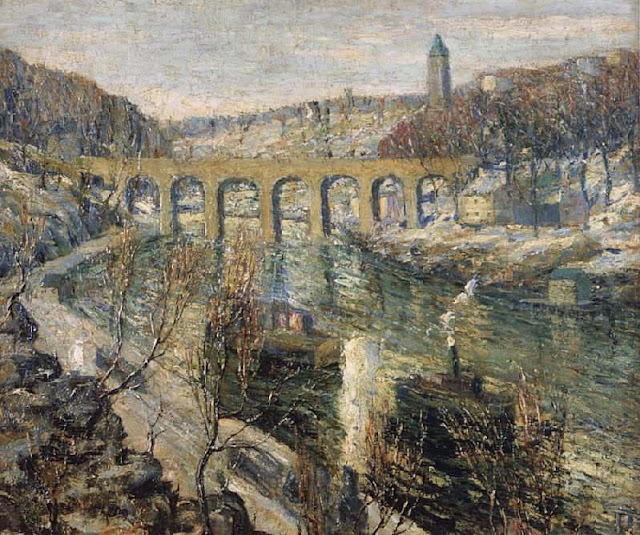
The image size is (640, 535). I want to click on windows, so click(x=477, y=214), click(x=476, y=204).